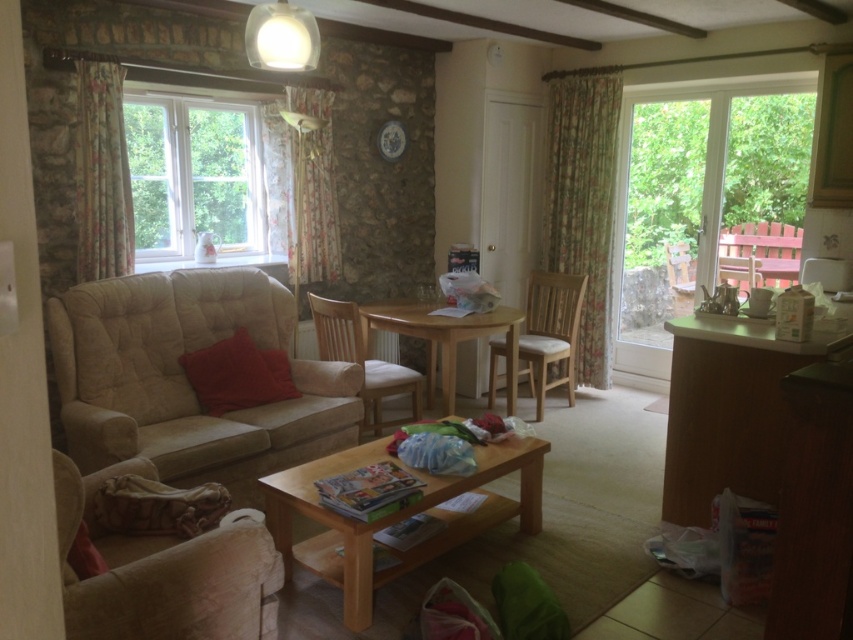
Question: Which object appears farthest from the camera in this image?

Choices:
 (A) floral fabric curtain at right
 (B) beige fabric couch at left
 (C) light wood table at center

Answer: (A)

Question: Is floral fabric curtain at right thinner than light wood table at center?

Choices:
 (A) yes
 (B) no

Answer: (A)

Question: Is light brown wood chair at center bigger than wooden chair at right?

Choices:
 (A) yes
 (B) no

Answer: (A)

Question: Based on their relative distances, which object is farther from the floral fabric curtain at upper left?

Choices:
 (A) light brown fabric armchair at center
 (B) wooden table at center
 (C) beige fabric armchair at lower left

Answer: (C)

Question: Estimate the real-world distances between objects in this image. Which object is closer to the floral fabric curtain at right?

Choices:
 (A) light wood table at center
 (B) clear glass window at left

Answer: (A)

Question: Does beige fabric couch at left have a larger size compared to wooden chair at right?

Choices:
 (A) yes
 (B) no

Answer: (A)